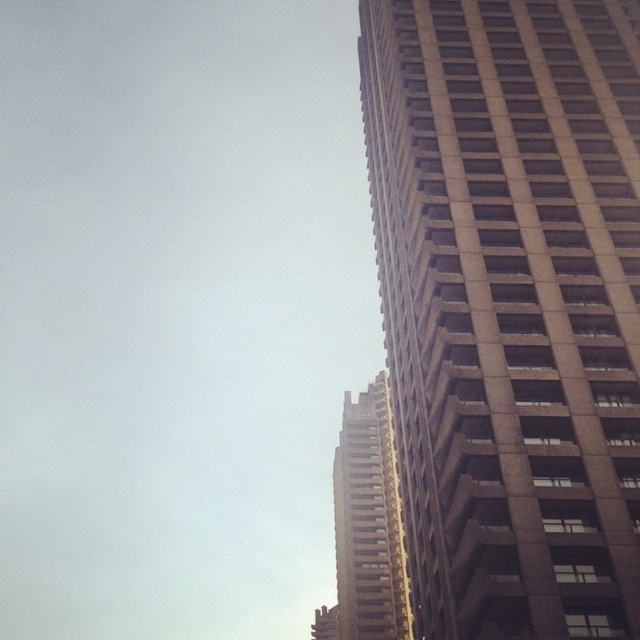
You are a drone operator tasked with flying a drone between two brown concrete buildings. The drone has a maximum flight distance of 200 feet. You observe the brown concrete building at right and the brown concrete building at center in the scene. Can the drone safely fly between them without exceeding its maximum flight range?

The distance between the brown concrete building at right and the brown concrete building at center is 201.45 feet, which exceeds the drone operator maximum flight distance of 200 feet. Therefore, the drone cannot safely fly between them without exceeding its maximum flight range.

You are standing on the sidewalk and looking up at the two brown concrete buildings. Which one is closer to you, the brown concrete building at right or the brown concrete building at center?

The brown concrete building at right is closer to you because it is in front of the brown concrete building at center.